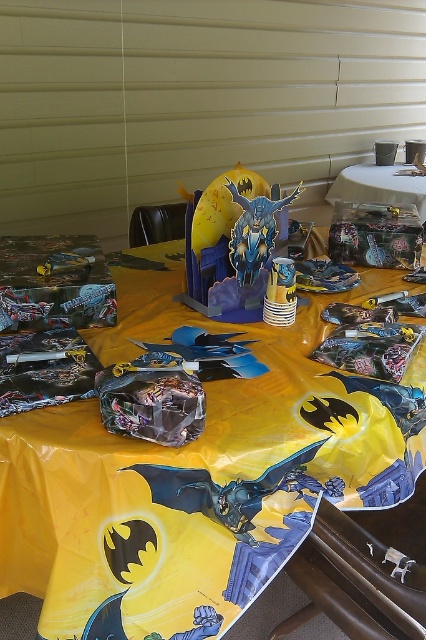
Question: Which point is closer to the camera?

Choices:
 (A) (190, 209)
 (B) (345, 460)

Answer: (B)

Question: Which is farther from the clear plastic table at upper center?

Choices:
 (A) yellow plastic tablecloth at center
 (B) blue plastic batman at center

Answer: (B)

Question: Is yellow plastic tablecloth at center above blue plastic batman at center?

Choices:
 (A) no
 (B) yes

Answer: (A)

Question: Which point is farther to the camera?

Choices:
 (A) (259, 246)
 (B) (302, 365)

Answer: (A)

Question: Is yellow plastic tablecloth at center above blue plastic batman at center?

Choices:
 (A) yes
 (B) no

Answer: (B)

Question: Is blue plastic batman at center behind clear plastic table at upper center?

Choices:
 (A) no
 (B) yes

Answer: (A)